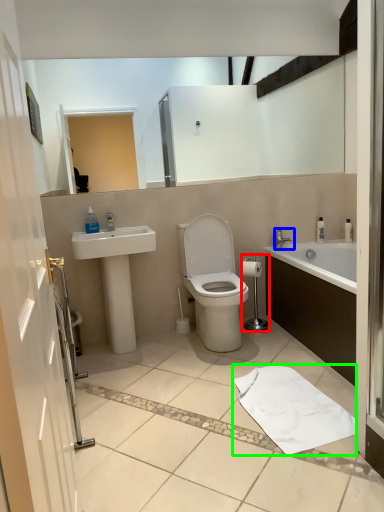
Question: Estimate the real-world distances between objects in this image. Which object is closer to shower (highlighted by a red box), tap (highlighted by a blue box) or bath towel (highlighted by a green box)?

Choices:
 (A) tap
 (B) bath towel

Answer: (A)